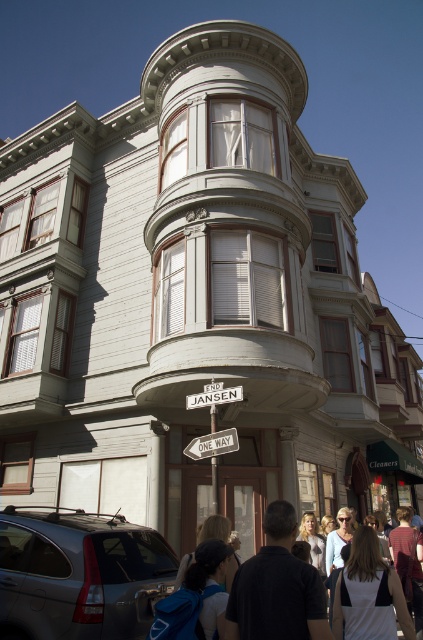
Between satin silver suv at lower left and matte black backpack at lower center, which one is positioned higher?

matte black backpack at lower center

Can you confirm if satin silver suv at lower left is taller than matte black backpack at lower center?

Indeed, satin silver suv at lower left has a greater height compared to matte black backpack at lower center.

Who is more distant from viewer, (104,520) or (258,596)?

Point (104,520)

You are a GUI agent. You are given a task and a screenshot of the screen. Output one action in this format:
    pyautogui.click(x=<x>, y=<y>)
    Task: Click on the satin silver suv at lower left
    
    Given the screenshot: What is the action you would take?
    pyautogui.click(x=79, y=576)

Can you confirm if matte black backpack at lower center is positioned to the left of metallic silver one-way sign at center?

Incorrect, matte black backpack at lower center is not on the left side of metallic silver one-way sign at center.

Locate an element on the screen. matte black backpack at lower center is located at coordinates (266, 586).

Looking at this image, is satin silver suv at lower left further to camera compared to metallic silver one-way sign at center?

No.

Between point (68, 588) and point (217, 452), which one is positioned in front?

Point (68, 588)

Describe the element at coordinates (79, 576) in the screenshot. I see `satin silver suv at lower left` at that location.

What are the coordinates of `satin silver suv at lower left` in the screenshot? It's located at (79, 576).